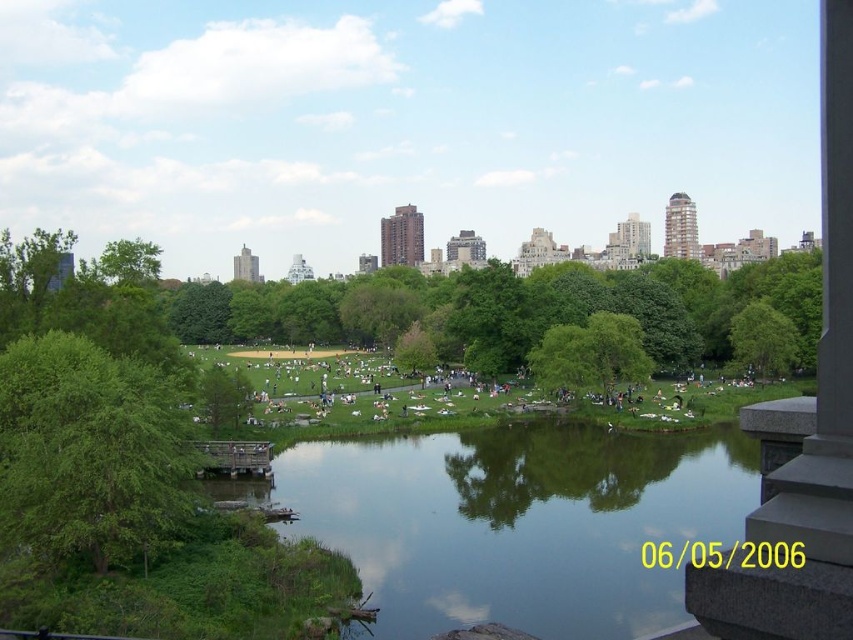
Question: Can you confirm if green grassy river at center is positioned below green leafy tree at center-right?

Choices:
 (A) yes
 (B) no

Answer: (A)

Question: Which point is farther to the camera?

Choices:
 (A) green leafy tree at center
 (B) green grassy river at center
 (C) green leafy tree at left
 (D) green leafy tree at center-right

Answer: (A)

Question: Is green grassy river at center to the right of green leafy tree at center from the viewer's perspective?

Choices:
 (A) yes
 (B) no

Answer: (A)

Question: Estimate the real-world distances between objects in this image. Which object is farther from the green leafy tree at center?

Choices:
 (A) green leafy tree at left
 (B) green leafy tree at center-right
 (C) green grassy river at center

Answer: (A)

Question: Based on their relative distances, which object is farther from the green leafy tree at center-right?

Choices:
 (A) green leafy tree at center
 (B) green grassy river at center
 (C) green leafy tree at left

Answer: (C)

Question: Does green leafy tree at center-right appear under green leafy tree at center?

Choices:
 (A) yes
 (B) no

Answer: (B)